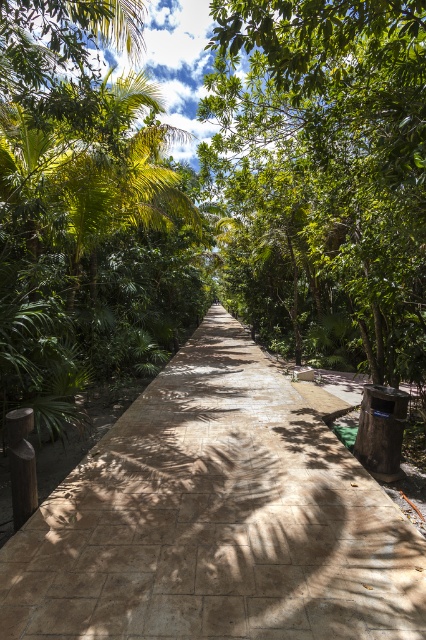
Can you confirm if brown stone pavement at center is thinner than green leafy tree at center?

Yes, brown stone pavement at center is thinner than green leafy tree at center.

Can you confirm if brown stone pavement at center is wider than green leafy tree at center?

Incorrect, brown stone pavement at center's width does not surpass green leafy tree at center's.

Measure the distance between point (195, 589) and camera.

A distance of 8.88 feet exists between point (195, 589) and camera.

Identify the location of brown stone pavement at center. This screenshot has width=426, height=640. (215, 518).